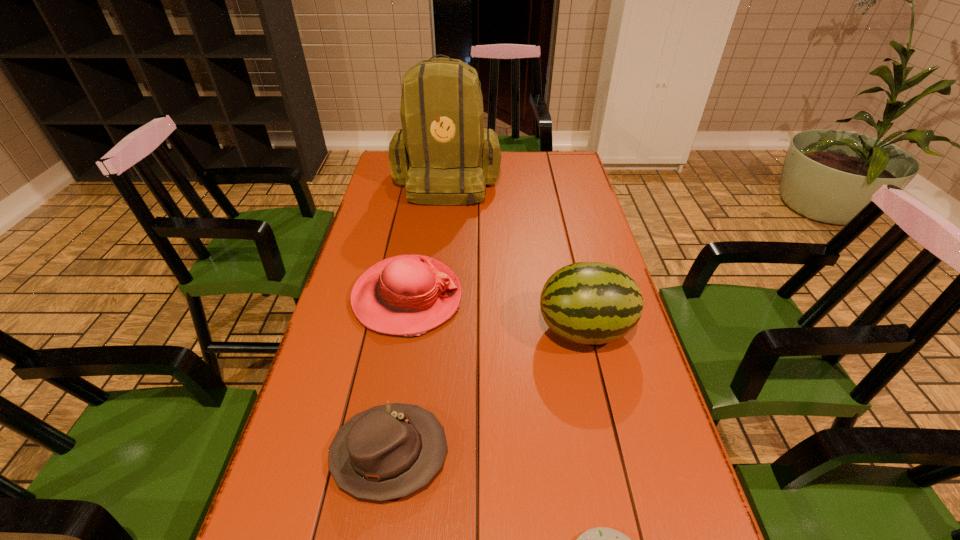
Image resolution: width=960 pixels, height=540 pixels. I want to click on free spot between the fourth shortest object and the farther hat, so click(496, 314).

The image size is (960, 540). I want to click on free space between the taller hat and the farthest object, so click(x=427, y=239).

Where is `vacant space in between the watermelon and the tallest object`? This screenshot has width=960, height=540. vacant space in between the watermelon and the tallest object is located at coordinates coord(516,255).

At what (x,y) coordinates should I click in order to perform the action: click on free space that is in between the second tallest object and the nearer hat. Please return your answer as a coordinate pair (x, y). Image resolution: width=960 pixels, height=540 pixels. Looking at the image, I should click on (487, 392).

Where is `vacant region between the second shortest object and the watermelon`? vacant region between the second shortest object and the watermelon is located at coordinates (487, 392).

I want to click on vacant point located between the watermelon and the second shortest object, so click(487, 392).

The width and height of the screenshot is (960, 540). Identify the location of the closest object to the watermelon. (406, 295).

The image size is (960, 540). In order to click on object that is the second closest to the second shortest object in this screenshot , I will do `click(601, 539)`.

At what (x,y) coordinates should I click in order to perform the action: click on vacant region that satisfies the following two spatial constraints: 1. on the front-facing side of the farthest object; 2. on the decorative side of the fourth tallest object. Please return your answer as a coordinate pair (x, y). Image resolution: width=960 pixels, height=540 pixels. Looking at the image, I should click on (418, 454).

Where is `free space that satisfies the following two spatial constraints: 1. on the front-facing side of the backpack; 2. at the front of the farther hat with a bow`? This screenshot has width=960, height=540. free space that satisfies the following two spatial constraints: 1. on the front-facing side of the backpack; 2. at the front of the farther hat with a bow is located at coordinates (434, 298).